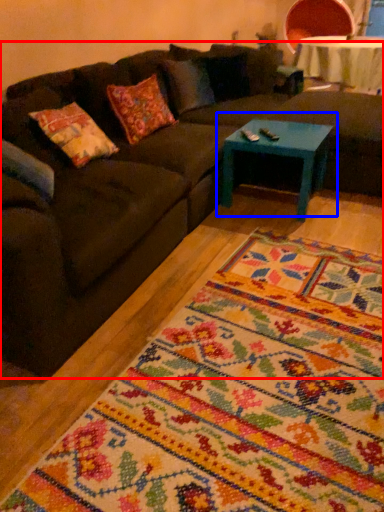
Question: Among these objects, which one is farthest to the camera, studio couch (highlighted by a red box) or coffee table (highlighted by a blue box)?

Choices:
 (A) studio couch
 (B) coffee table

Answer: (B)